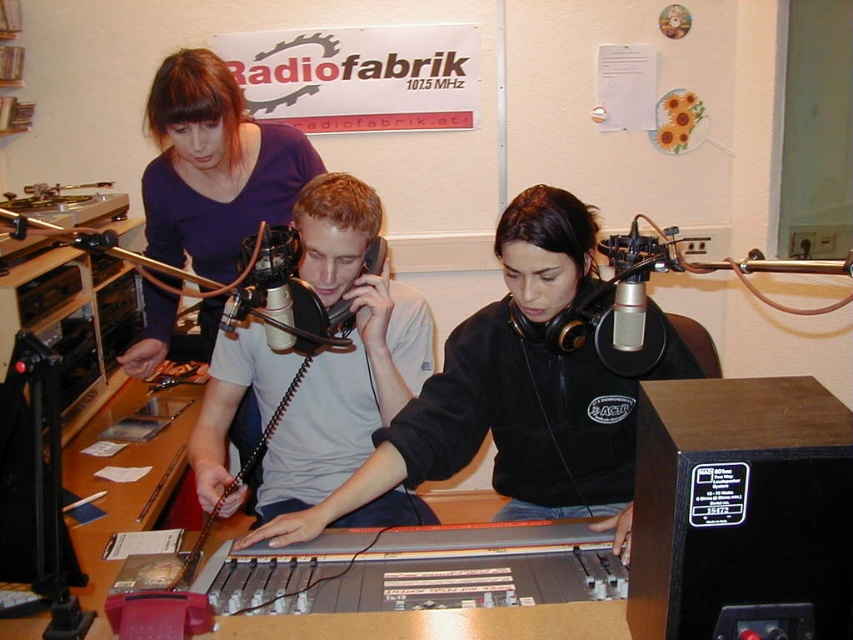
Can you confirm if matte gray shirt at center is smaller than matte purple shirt at upper left?

Incorrect, matte gray shirt at center is not smaller in size than matte purple shirt at upper left.

Where is `matte gray shirt at center`? This screenshot has height=640, width=853. matte gray shirt at center is located at coordinates (518, 394).

Can you confirm if matte gray shirt at center is positioned to the right of white matte shirt at center?

Indeed, matte gray shirt at center is positioned on the right side of white matte shirt at center.

Which is more to the right, matte gray shirt at center or white matte shirt at center?

matte gray shirt at center is more to the right.

Does point (532, 420) lie behind point (314, 406)?

No.

You are a GUI agent. You are given a task and a screenshot of the screen. Output one action in this format:
    pyautogui.click(x=<x>, y=<y>)
    Task: Click on the matte gray shirt at center
    This screenshot has width=853, height=640.
    Given the screenshot: What is the action you would take?
    pyautogui.click(x=518, y=394)

Which is behind, point (216, 465) or point (218, 237)?

Point (218, 237)

Does white matte shirt at center have a greater width compared to matte purple shirt at upper left?

No, white matte shirt at center is not wider than matte purple shirt at upper left.

Is point (363, 237) closer to camera compared to point (260, 212)?

Yes, it is.

Find the location of a particular element. The height and width of the screenshot is (640, 853). white matte shirt at center is located at coordinates (344, 352).